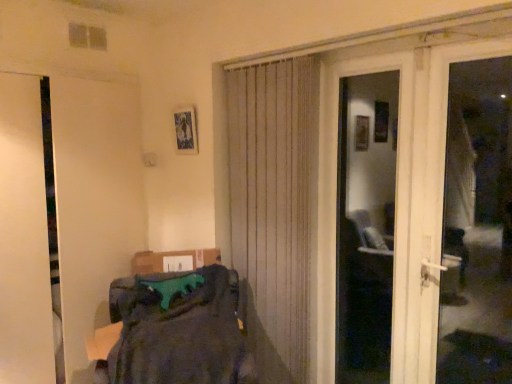
Question: Is dark gray fabric at lower left located within white plastic door handle at right?

Choices:
 (A) yes
 (B) no

Answer: (B)

Question: Would you say white plastic door handle at right is a long distance from dark gray fabric at lower left?

Choices:
 (A) yes
 (B) no

Answer: (A)

Question: From the image's perspective, is white plastic door handle at right above dark gray fabric at lower left?

Choices:
 (A) yes
 (B) no

Answer: (A)

Question: Can you confirm if white plastic door handle at right is shorter than dark gray fabric at lower left?

Choices:
 (A) no
 (B) yes

Answer: (A)

Question: From a real-world perspective, is white plastic door handle at right on top of dark gray fabric at lower left?

Choices:
 (A) no
 (B) yes

Answer: (B)

Question: Can we say white plastic door handle at right lies outside dark gray fabric at lower left?

Choices:
 (A) yes
 (B) no

Answer: (A)

Question: Is the position of metallic silver picture frame at upper center more distant than that of dark gray fabric at lower left?

Choices:
 (A) no
 (B) yes

Answer: (B)

Question: Does metallic silver picture frame at upper center have a smaller size compared to dark gray fabric at lower left?

Choices:
 (A) no
 (B) yes

Answer: (B)

Question: Considering the relative sizes of metallic silver picture frame at upper center and dark gray fabric at lower left in the image provided, is metallic silver picture frame at upper center thinner than dark gray fabric at lower left?

Choices:
 (A) no
 (B) yes

Answer: (B)

Question: Does metallic silver picture frame at upper center appear on the left side of dark gray fabric at lower left?

Choices:
 (A) yes
 (B) no

Answer: (A)

Question: Considering the relative sizes of metallic silver picture frame at upper center and dark gray fabric at lower left in the image provided, is metallic silver picture frame at upper center shorter than dark gray fabric at lower left?

Choices:
 (A) yes
 (B) no

Answer: (A)

Question: Does metallic silver picture frame at upper center have a larger size compared to dark gray fabric at lower left?

Choices:
 (A) no
 (B) yes

Answer: (A)

Question: Is white glossy door at center, arranged as the second door when viewed from the left, completely or partially inside beige textured curtain at center?

Choices:
 (A) yes
 (B) no

Answer: (B)